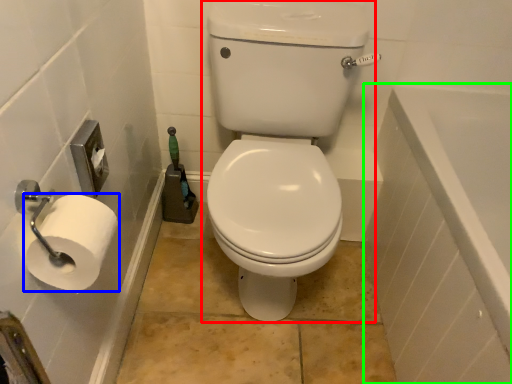
Question: Which object is the farthest from sit (highlighted by a red box)? Choose among these: toilet paper (highlighted by a blue box) or bath (highlighted by a green box).

Choices:
 (A) toilet paper
 (B) bath

Answer: (A)